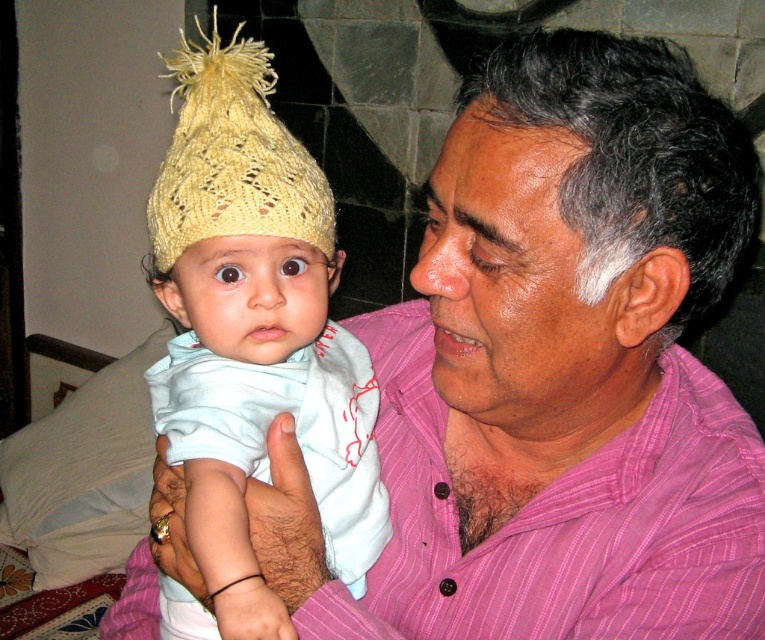
Who is higher up, knitted yellow hat at left or yellow knitted hat at upper left?

Positioned higher is yellow knitted hat at upper left.

From the picture: Which is more to the left, knitted yellow hat at left or yellow knitted hat at upper left?

yellow knitted hat at upper left is more to the left.

Which is behind, point (187, 404) or point (158, 173)?

Point (158, 173)

At what (x,y) coordinates should I click in order to perform the action: click on knitted yellow hat at left. Please return your answer as a coordinate pair (x, y). The width and height of the screenshot is (765, 640). Looking at the image, I should click on (252, 340).